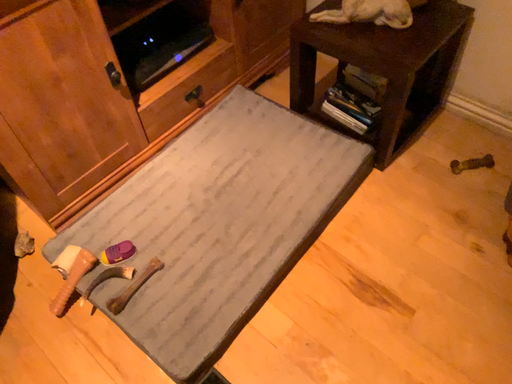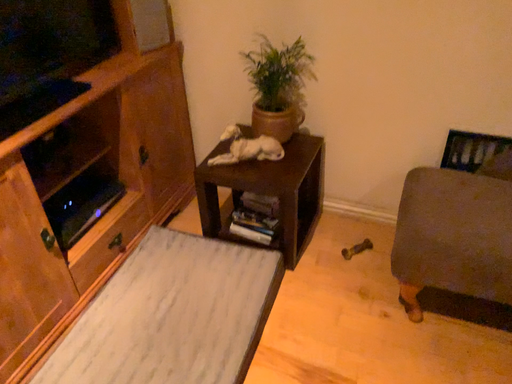
Question: How did the camera likely rotate when shooting the video?

Choices:
 (A) rotated right
 (B) rotated left

Answer: (A)